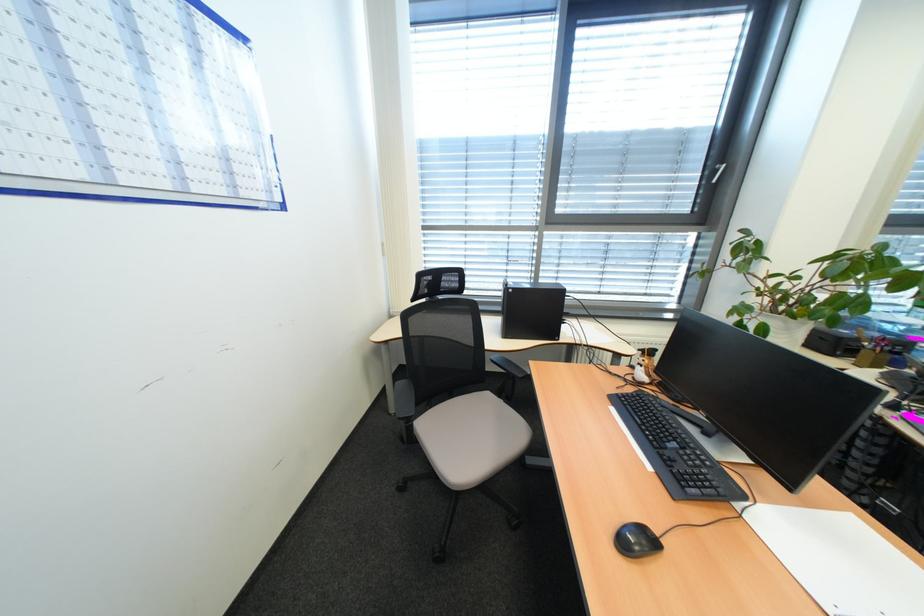
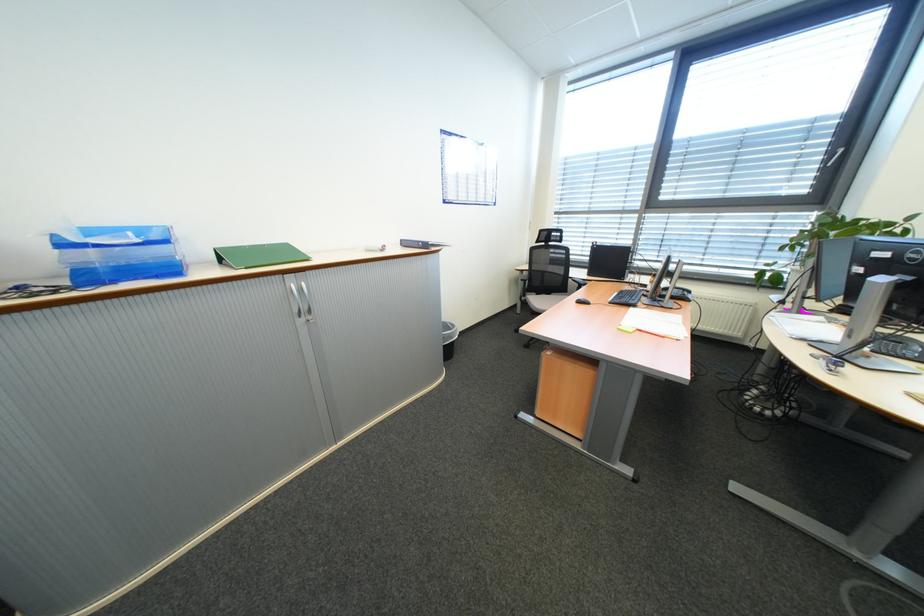
In the second image, find the point that corresponds to (x=661, y=469) in the first image.

(619, 302)